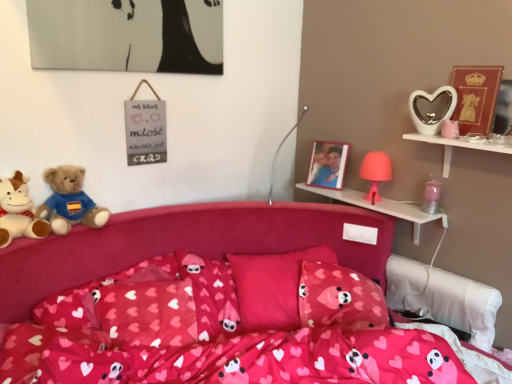
Find the location of a particular element. vacant space to the left of metallic silver jar at upper right, the 4th toy from the top is located at coordinates pos(403,210).